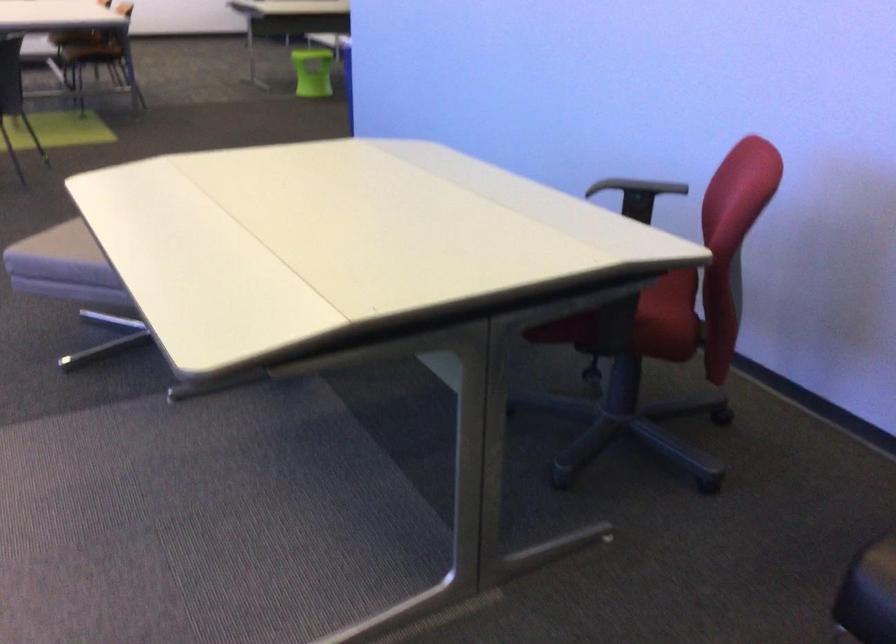
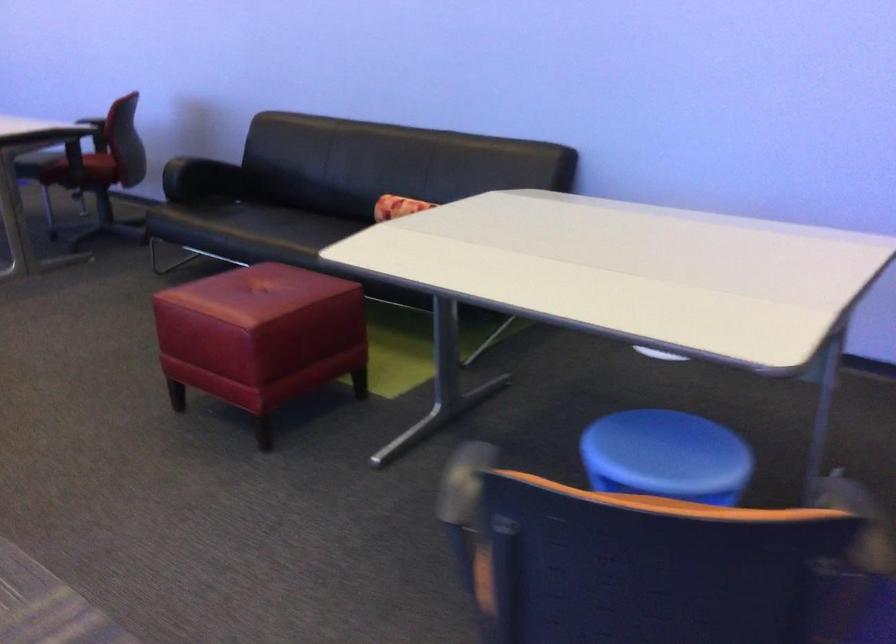
Question: I am providing you with two images of the same scene from different viewpoints. Please identify which objects are invisible in image2.

Choices:
 (A) black chair armrest
 (B) sofa sitting surface
 (C) blue round stool
 (D) checkered kitchen towel

Answer: (A)